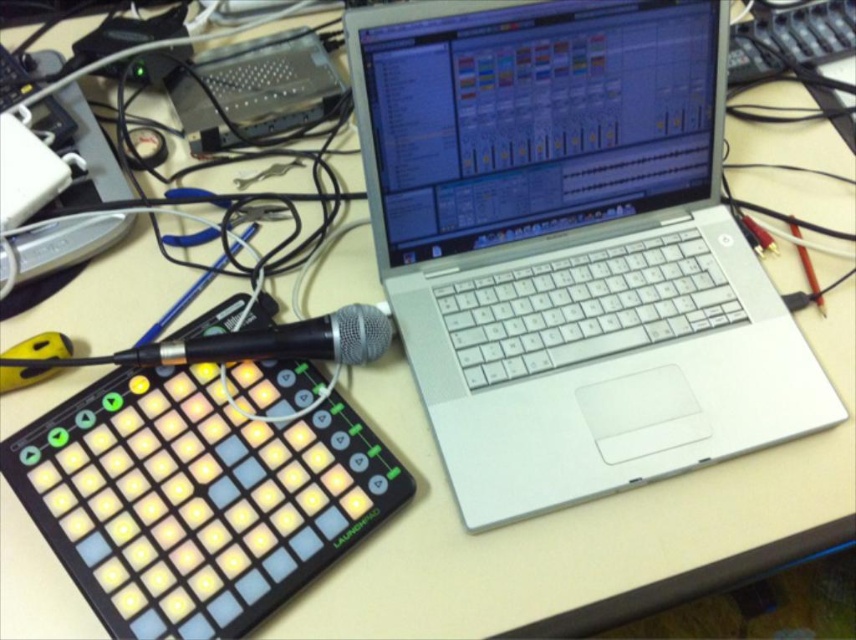
Question: Which object appears farthest from the camera in this image?

Choices:
 (A) silver metallic laptop at center
 (B) black matte microphone at center-left

Answer: (B)

Question: Among these objects, which one is farthest from the camera?

Choices:
 (A) black matte microphone at center-left
 (B) silver metallic laptop at center

Answer: (A)

Question: Can you confirm if silver metallic laptop at center is smaller than black matte microphone at center-left?

Choices:
 (A) yes
 (B) no

Answer: (B)

Question: Is silver metallic laptop at center in front of black matte microphone at center-left?

Choices:
 (A) yes
 (B) no

Answer: (A)

Question: Is silver metallic laptop at center below black matte microphone at center-left?

Choices:
 (A) yes
 (B) no

Answer: (B)

Question: Which of the following is the closest to the observer?

Choices:
 (A) silver metallic laptop at center
 (B) black matte microphone at center-left

Answer: (A)